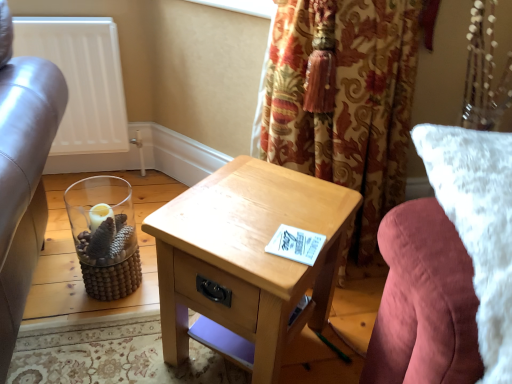
Question: From the image's perspective, is white fluffy pillow at right positioned above or below white matte radiator at upper left?

Choices:
 (A) above
 (B) below

Answer: (B)

Question: Based on their sizes in the image, would you say white fluffy pillow at right is bigger or smaller than white matte radiator at upper left?

Choices:
 (A) small
 (B) big

Answer: (B)

Question: Estimate the real-world distances between objects in this image. Which object is farther from the clear glass vase at lower left?

Choices:
 (A) white matte radiator at upper left
 (B) light wood/texture nightstand at center
 (C) white fluffy pillow at right

Answer: (C)

Question: Estimate the real-world distances between objects in this image. Which object is closer to the white matte radiator at upper left?

Choices:
 (A) light wood/texture nightstand at center
 (B) white fluffy pillow at right
 (C) clear glass vase at lower left

Answer: (C)